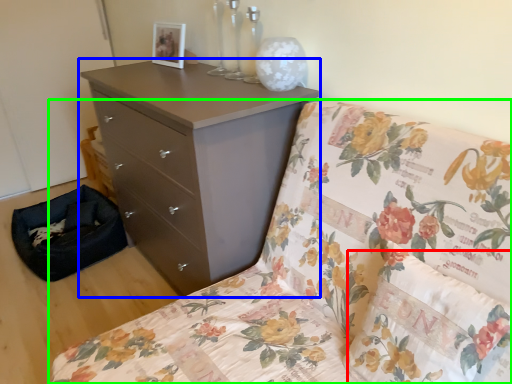
Question: Which object is positioned farthest from pillow (highlighted by a red box)? Select from chest of drawers (highlighted by a blue box) and furniture (highlighted by a green box).

Choices:
 (A) chest of drawers
 (B) furniture

Answer: (A)